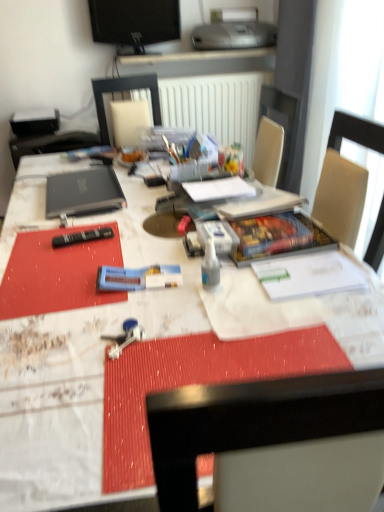
This screenshot has width=384, height=512. I want to click on vacant space that is to the left of white paper at center, so click(157, 208).